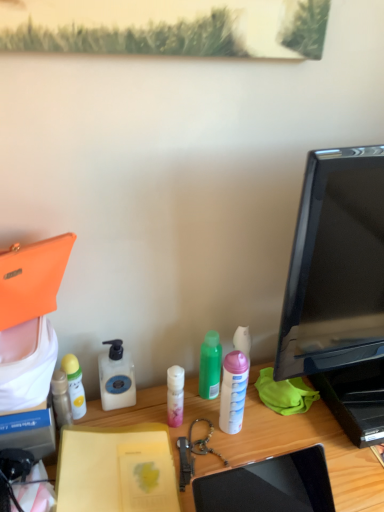
You are a GUI agent. You are given a task and a screenshot of the screen. Output one action in this format:
    pyautogui.click(x=<x>, y=<y>)
    Task: Click on the unoccupied region to the right of green matte bottle at center, which is the 2th bottle in right-to-left order
    
    Given the screenshot: What is the action you would take?
    pyautogui.click(x=283, y=414)